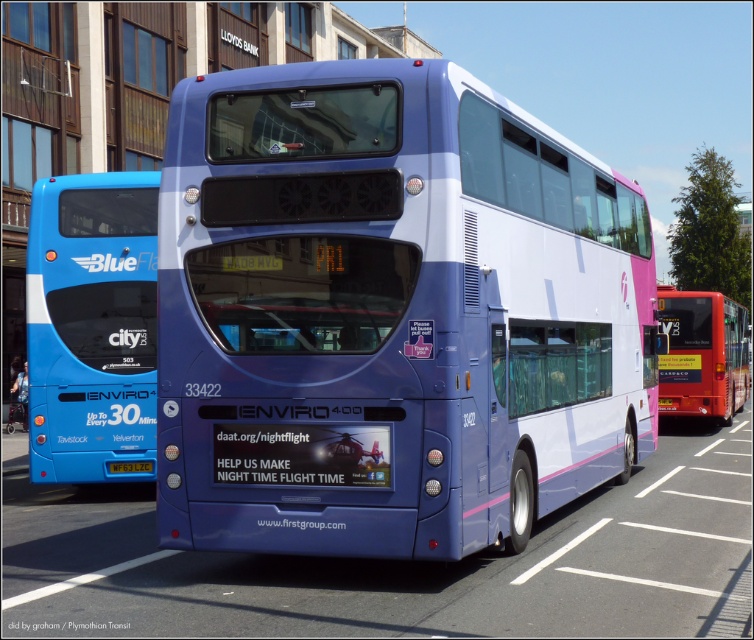
You are standing at the bus station and want to take a photo of the matte purple bus at center. If your camera can focus on objects up to 20 feet away, will you need to move closer to take a clear photo?

The matte purple bus at center is 21.59 feet away from the viewer, which is beyond the camera focus range of 20 feet. Therefore, you need to move closer to ensure the matte purple bus at center is within the camera focus range.

You are standing at the point with coordinates point (x=411, y=340) and want to walk to the point with coordinates point (x=702, y=376). Which direction should you move in?

You should move backward because point (x=411, y=340) is in front of point (x=702, y=376).